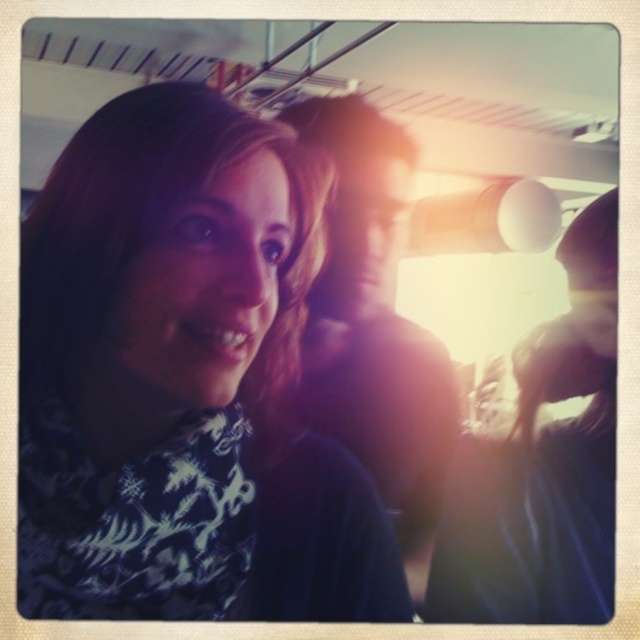
Question: Which point is closer to the camera taking this photo?

Choices:
 (A) (333, 417)
 (B) (209, 506)

Answer: (B)

Question: Does matte black scarf at left appear over smooth dark hair at center?

Choices:
 (A) no
 (B) yes

Answer: (A)

Question: Observing the image, what is the correct spatial positioning of matte black scarf at left in reference to smooth dark hair at center?

Choices:
 (A) left
 (B) right

Answer: (A)

Question: Which point is farther to the camera?

Choices:
 (A) matte black scarf at left
 (B) smooth dark hair at center

Answer: (B)

Question: Is matte black scarf at left below smooth dark hair at center?

Choices:
 (A) yes
 (B) no

Answer: (A)